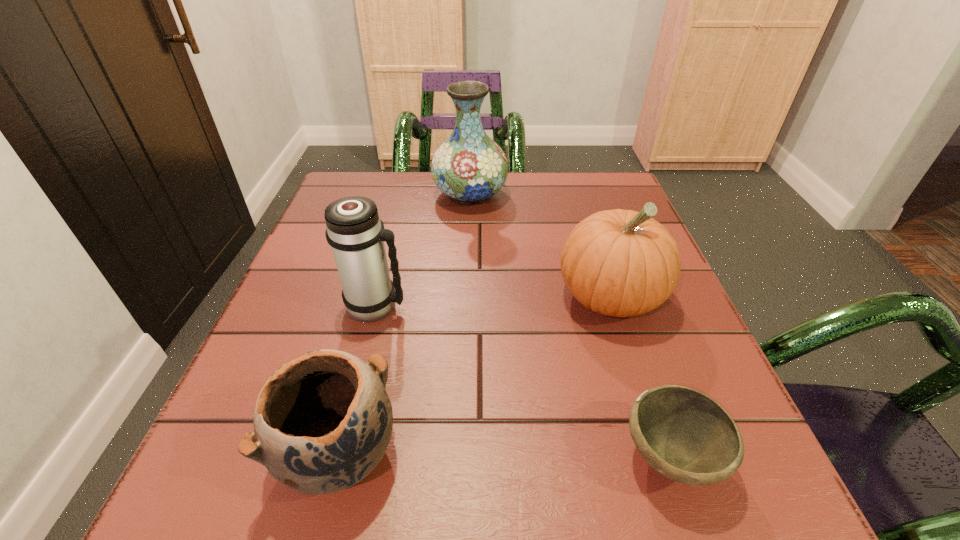
At what (x,y) coordinates should I click in order to perform the action: click on free space between the pumpkin and the shortest object. Please return your answer as a coordinate pair (x, y). The height and width of the screenshot is (540, 960). Looking at the image, I should click on (639, 377).

What are the coordinates of `free space between the bowl and the thermos bottle` in the screenshot? It's located at (523, 382).

At what (x,y) coordinates should I click in order to perform the action: click on empty space between the second shortest object and the vase. Please return your answer as a coordinate pair (x, y). The width and height of the screenshot is (960, 540). Looking at the image, I should click on (404, 323).

The image size is (960, 540). In order to click on free space between the pottery and the farthest object in this screenshot , I will do pyautogui.click(x=404, y=323).

This screenshot has height=540, width=960. In order to click on object identified as the second closest to the thermos bottle in this screenshot , I will do `click(469, 167)`.

Choose which object is the second nearest neighbor to the thermos bottle. Please provide its 2D coordinates. Your answer should be formatted as a tuple, i.e. [(x, y)], where the tuple contains the x and y coordinates of a point satisfying the conditions above.

[(469, 167)]

Identify the location of vacant area that satisfies the following two spatial constraints: 1. on the stem of the bowl; 2. on the right side of the pumpkin. The image size is (960, 540). (661, 458).

Locate an element on the screen. The image size is (960, 540). vacant space that satisfies the following two spatial constraints: 1. on the side with the handle of the thermos bottle; 2. on the front side of the second shortest object is located at coordinates (339, 453).

I want to click on free location that satisfies the following two spatial constraints: 1. on the front side of the farthest object; 2. on the right side of the bowl, so click(x=462, y=458).

Find the location of a particular element. The image size is (960, 540). vacant area in the image that satisfies the following two spatial constraints: 1. on the stem of the pumpkin; 2. on the right side of the bowl is located at coordinates (661, 458).